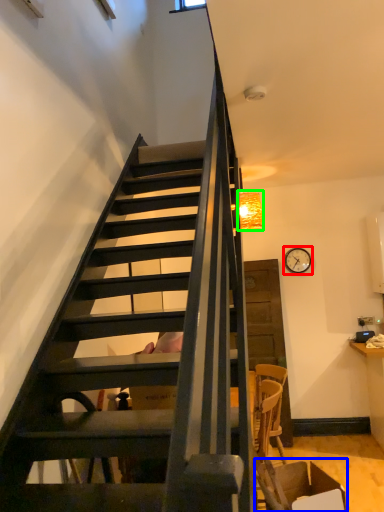
Question: Which object is the closest to the clock (highlighted by a red box)? Choose among these: armchair (highlighted by a blue box) or lamp (highlighted by a green box).

Choices:
 (A) armchair
 (B) lamp

Answer: (B)